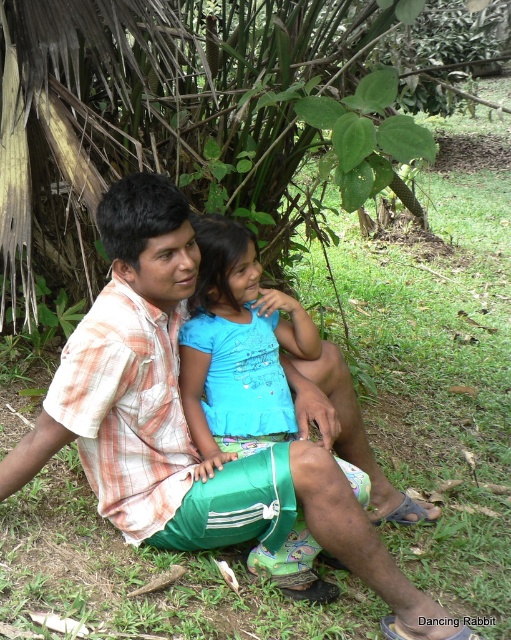
Question: Estimate the real-world distances between objects in this image. Which object is closer to the plaid cotton shirt at center?

Choices:
 (A) green leafy tree at upper center
 (B) blue fabric shirt at center

Answer: (B)

Question: Does green leafy tree at upper center appear on the right side of plaid cotton shirt at center?

Choices:
 (A) no
 (B) yes

Answer: (B)

Question: Which point appears farthest from the camera in this image?

Choices:
 (A) (196, 228)
 (B) (92, 374)
 (C) (36, 10)

Answer: (C)

Question: Among these points, which one is farthest from the camera?

Choices:
 (A) (102, 301)
 (B) (120, 77)

Answer: (B)

Question: Can you confirm if green leafy tree at upper center is positioned to the right of plaid cotton shirt at center?

Choices:
 (A) no
 (B) yes

Answer: (B)

Question: Is plaid cotton shirt at center smaller than blue fabric shirt at center?

Choices:
 (A) yes
 (B) no

Answer: (B)